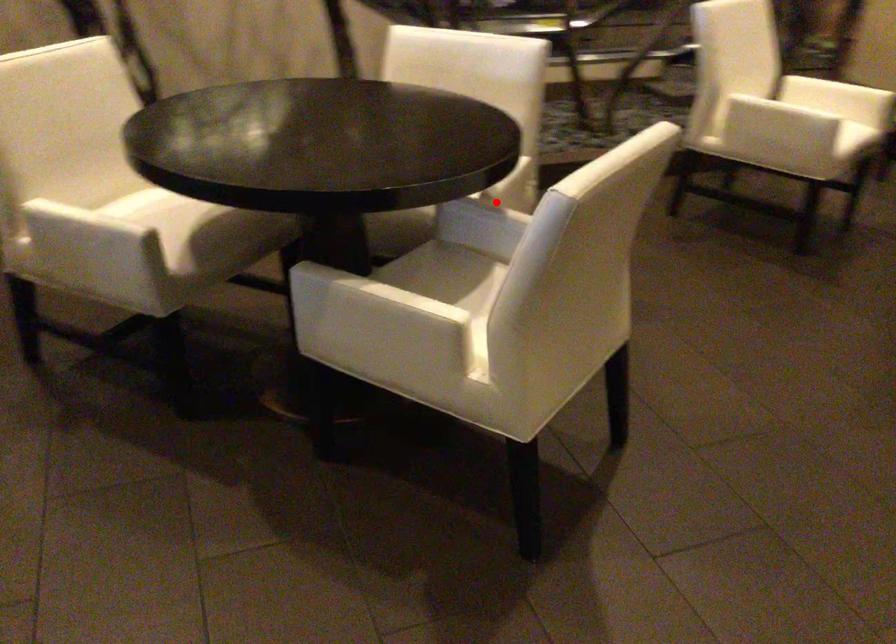
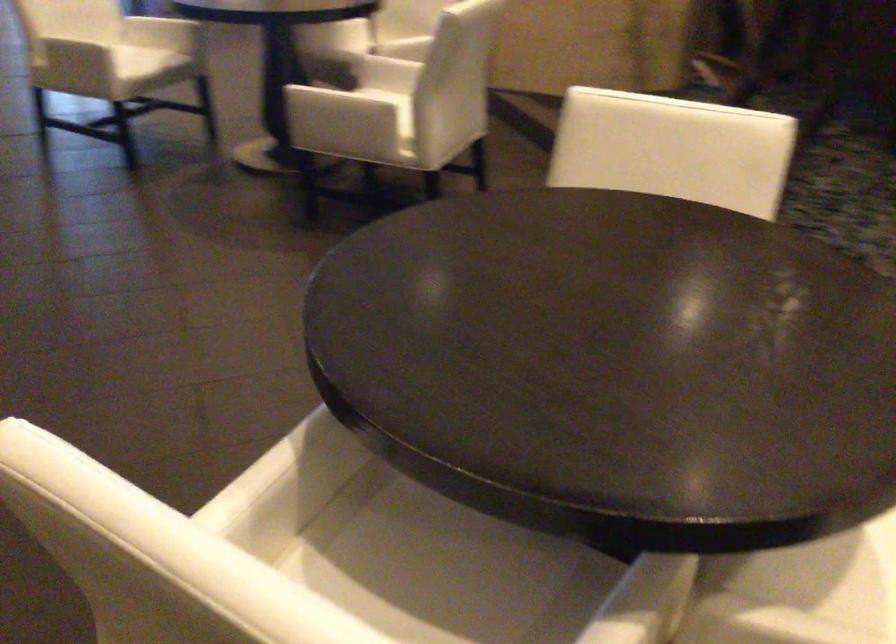
Find the pixel in the second image that matches the highlighted location in the first image.

(643, 601)